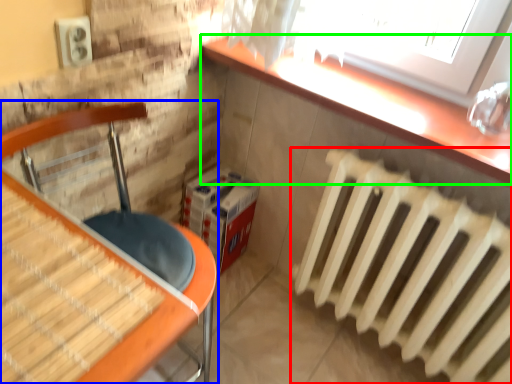
Question: Estimate the real-world distances between objects in this image. Which object is closer to radiator (highlighted by a red box), furniture (highlighted by a blue box) or counter top (highlighted by a green box)?

Choices:
 (A) furniture
 (B) counter top

Answer: (B)